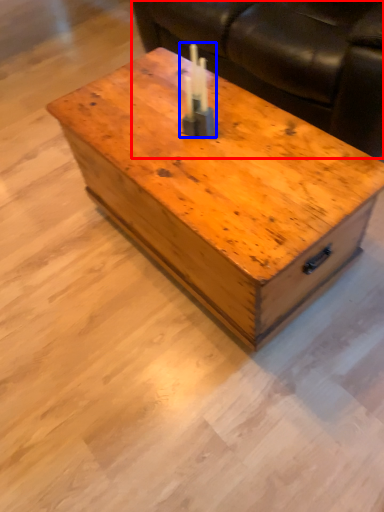
Question: Which point is further to the camera, couch (highlighted by a red box) or birthday candle (highlighted by a blue box)?

Choices:
 (A) couch
 (B) birthday candle

Answer: (A)